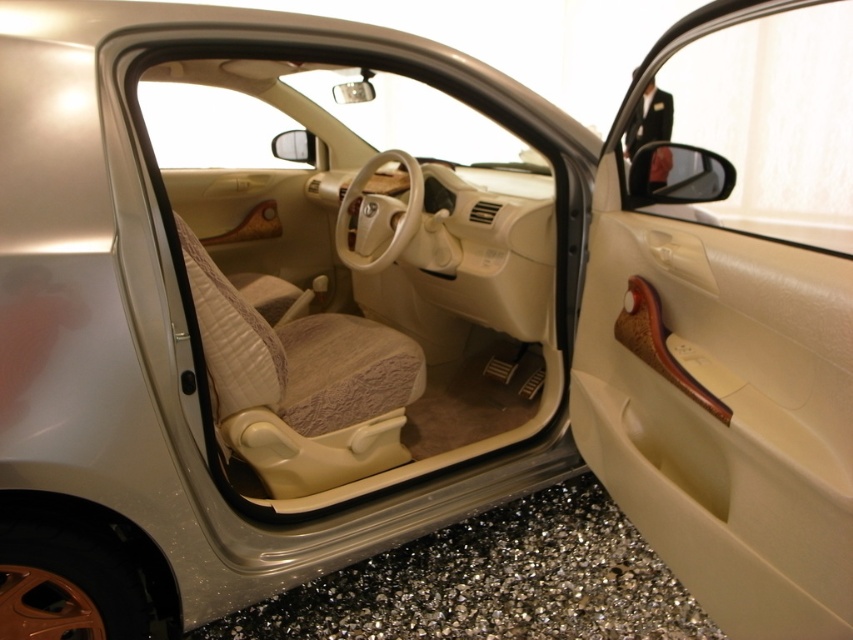
Question: Does beige fabric door at center have a lesser width compared to wooden handle at center?

Choices:
 (A) no
 (B) yes

Answer: (A)

Question: Which of the following is the farthest from the observer?

Choices:
 (A) (534, 136)
 (B) (685, 336)

Answer: (A)

Question: Which of the following is the closest to the observer?

Choices:
 (A) (323, 490)
 (B) (682, 481)

Answer: (B)

Question: From the image, what is the correct spatial relationship of beige fabric door at center in relation to wooden handle at center?

Choices:
 (A) below
 (B) above

Answer: (A)

Question: Does beige fabric door at center appear on the right side of wooden handle at center?

Choices:
 (A) no
 (B) yes

Answer: (A)